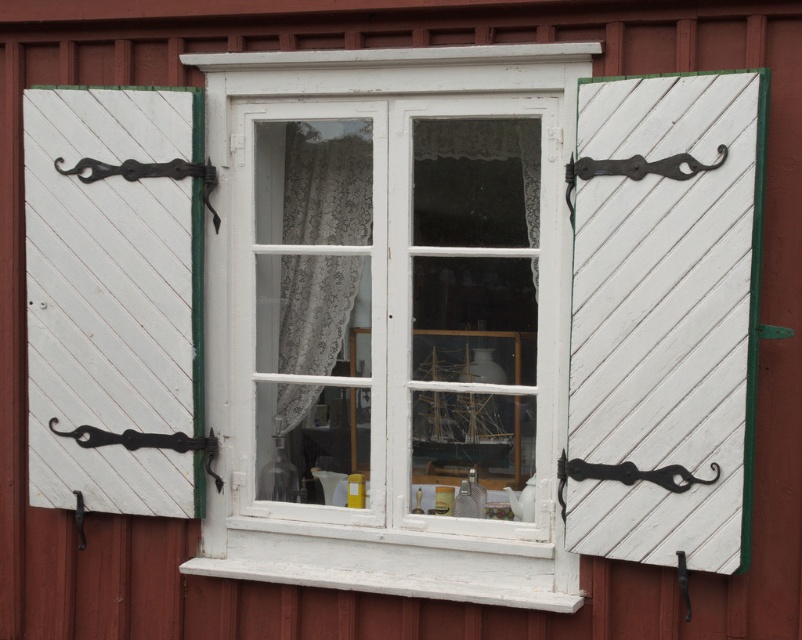
You are hanging a small picture frame that is 1 meter tall on the wall. The wall has the white painted wood at right and the black metal hook at left. Which object on the wall can support the picture frame without it touching the ground?

The white painted wood at right is taller than the black metal hook at left, so the white painted wood at right can support the picture frame without it touching the ground.

You are hanging a small plant hanger from the black metal hook at center near the white wood window frame at center. Will the plant hanger be visible through the window from outside?

The white wood window frame at center is to the left of the black metal hook at center, so the plant hanger hung from the black metal hook at center would be positioned to the right of the window frame. Since the window allows viewing into the interior, the plant hanger would be visible through the window from outside.